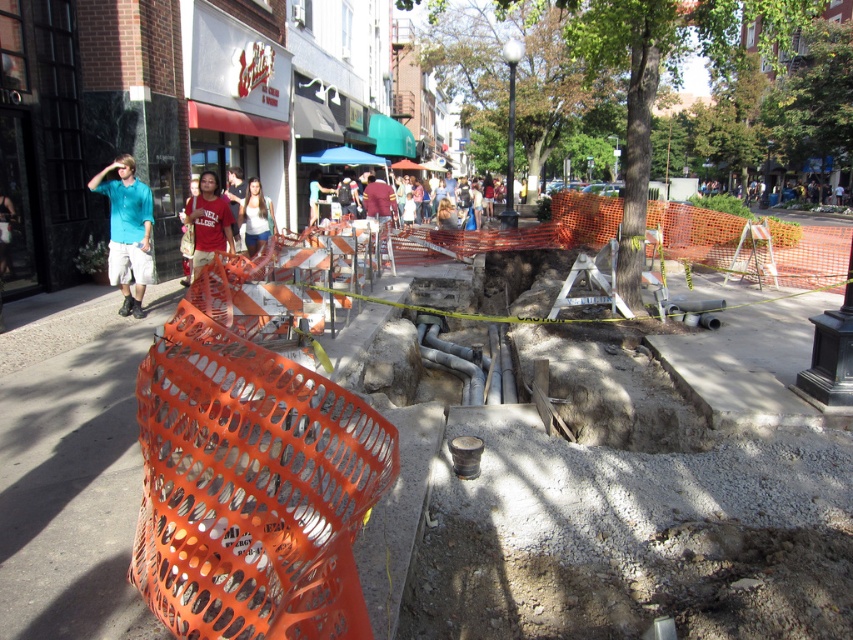
In the scene shown: You are a delivery person with a cart that is 1.5 meters wide. You need to navigate from the orange mesh barrier at center to the teal shirt at left. Is there enough space between them for your cart to pass through?

The distance between the orange mesh barrier at center and the teal shirt at left is 11.08 meters, so yes, the cart can pass through as the space is wider than the cart.